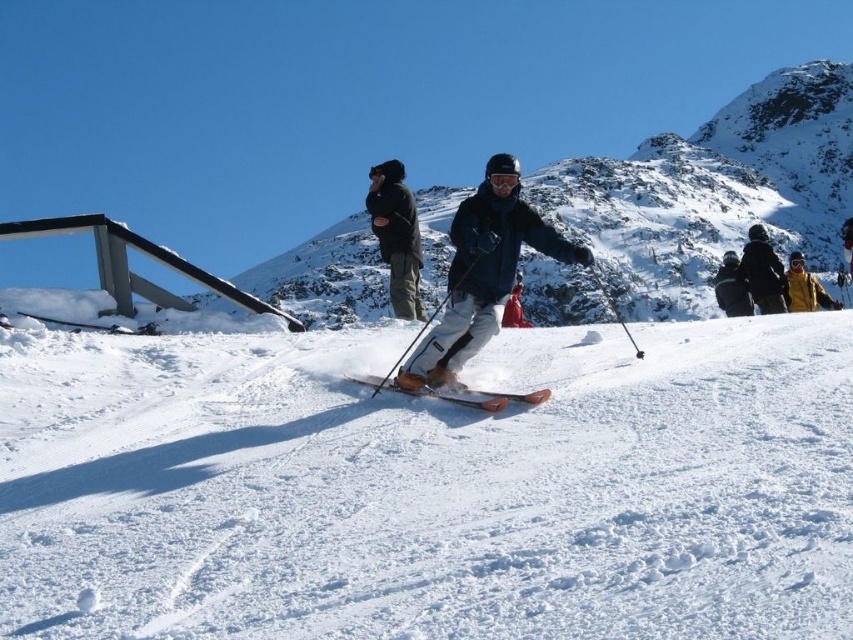
Who is taller, white snow at center or dark blue jacket at upper right?

Standing taller between the two is dark blue jacket at upper right.

Does white snow at center have a lesser height compared to dark blue jacket at upper right?

Yes.

Where is `white snow at center`? This screenshot has height=640, width=853. white snow at center is located at coordinates (460, 499).

Is black fabric jacket at upper center smaller than matte black jacket at right?

Yes.

The image size is (853, 640). What are the coordinates of `black fabric jacket at upper center` in the screenshot? It's located at [x=396, y=236].

Where is `black fabric jacket at upper center`? The height and width of the screenshot is (640, 853). black fabric jacket at upper center is located at coordinates (396, 236).

Can you confirm if white snow at center is bigger than shiny orange ski at center?

Yes, white snow at center is bigger than shiny orange ski at center.

Which is more to the left, white snow at center or shiny orange ski at center?

From the viewer's perspective, shiny orange ski at center appears more on the left side.

Identify the location of white snow at center. (460, 499).

Image resolution: width=853 pixels, height=640 pixels. Find the location of `white snow at center`. white snow at center is located at coordinates (460, 499).